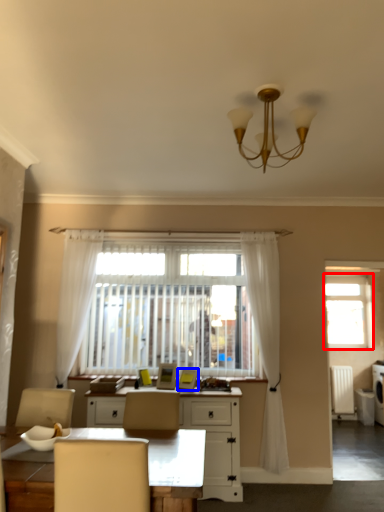
Question: Which object appears closest to the camera in this image, window (highlighted by a red box) or picture frame (highlighted by a blue box)?

Choices:
 (A) window
 (B) picture frame

Answer: (B)